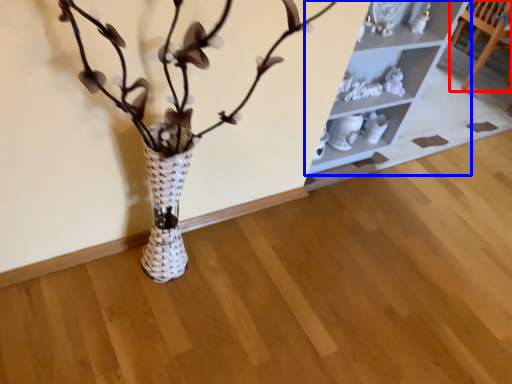
Question: Which object is further to the camera taking this photo, furniture (highlighted by a red box) or shelf (highlighted by a blue box)?

Choices:
 (A) furniture
 (B) shelf

Answer: (A)